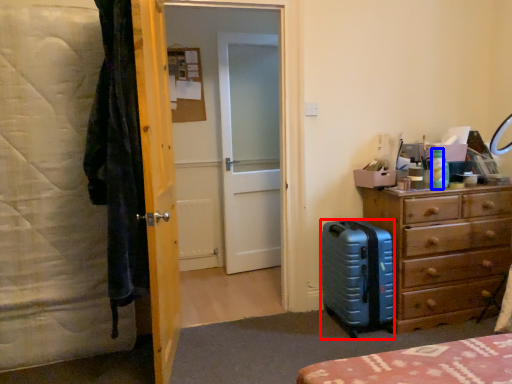
Question: Which object appears farthest to the camera in this image, suitcase (highlighted by a red box) or bottle (highlighted by a blue box)?

Choices:
 (A) suitcase
 (B) bottle

Answer: (B)